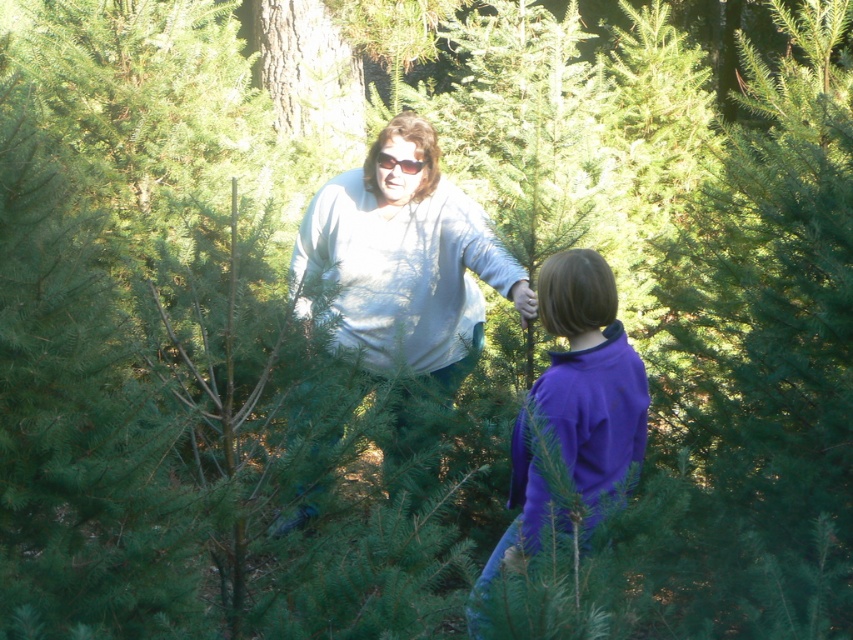
Question: From the image, what is the correct spatial relationship of white matte sweater at center in relation to purple fleece jacket at center?

Choices:
 (A) below
 (B) above

Answer: (B)

Question: Which of the following is the farthest from the observer?

Choices:
 (A) (x=595, y=388)
 (B) (x=498, y=285)

Answer: (B)

Question: Which of the following is the farthest from the observer?

Choices:
 (A) white matte sweater at center
 (B) purple fleece jacket at center

Answer: (A)

Question: Does white matte sweater at center have a greater width compared to purple fleece jacket at center?

Choices:
 (A) no
 (B) yes

Answer: (B)

Question: Is white matte sweater at center below purple fleece jacket at center?

Choices:
 (A) yes
 (B) no

Answer: (B)